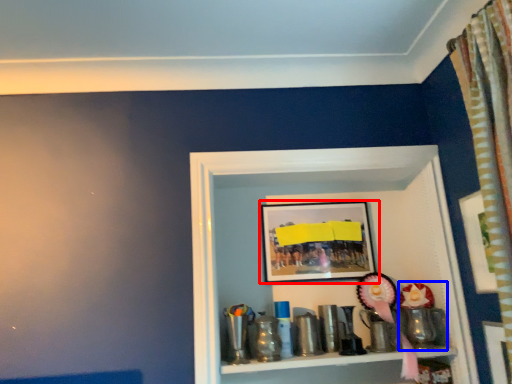
Question: Which point is closer to the camera, picture frame (highlighted by a red box) or toy (highlighted by a blue box)?

Choices:
 (A) picture frame
 (B) toy

Answer: (B)